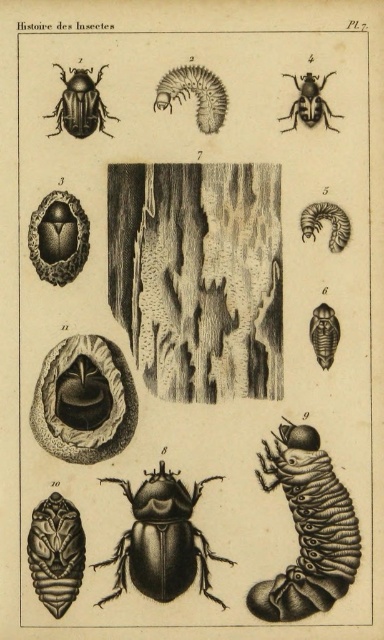
Which is more to the right, shiny brown exoskeleton at lower left or matte black beetle at upper center?

matte black beetle at upper center

Is shiny brown exoskeleton at lower left wider than matte black beetle at upper center?

No, shiny brown exoskeleton at lower left is not wider than matte black beetle at upper center.

Is point (46, 577) closer to camera compared to point (294, 115)?

That is True.

Identify the location of shiny brown exoskeleton at lower left. Image resolution: width=384 pixels, height=640 pixels. (56, 552).

How distant is smooth brown millipede at upper center from matte black beetle at upper left?

smooth brown millipede at upper center is 5.60 inches away from matte black beetle at upper left.

Which is in front, point (201, 99) or point (87, 84)?

Positioned in front is point (87, 84).

Between point (205, 81) and point (77, 116), which one is positioned behind?

Positioned behind is point (77, 116).

Image resolution: width=384 pixels, height=640 pixels. Identify the location of smooth brown millipede at upper center. (195, 93).

Which is behind, point (289, 440) or point (195, 570)?

The point (289, 440) is more distant.

How far apart are smooth black caterpillar at lower right and shiny black beetle at center?

6.16 inches

Does point (311, 577) come farther from viewer compared to point (139, 536)?

No, it is not.

Image resolution: width=384 pixels, height=640 pixels. What are the coordinates of `smooth black caterpillar at lower right` in the screenshot? It's located at click(x=307, y=529).